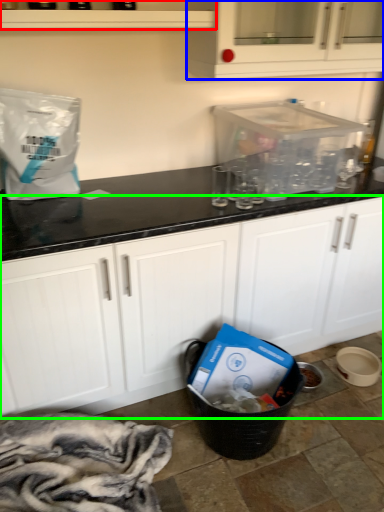
Question: Estimate the real-world distances between objects in this image. Which object is farther from shelf (highlighted by a red box), cabinetry (highlighted by a blue box) or cabinetry (highlighted by a green box)?

Choices:
 (A) cabinetry
 (B) cabinetry

Answer: (B)